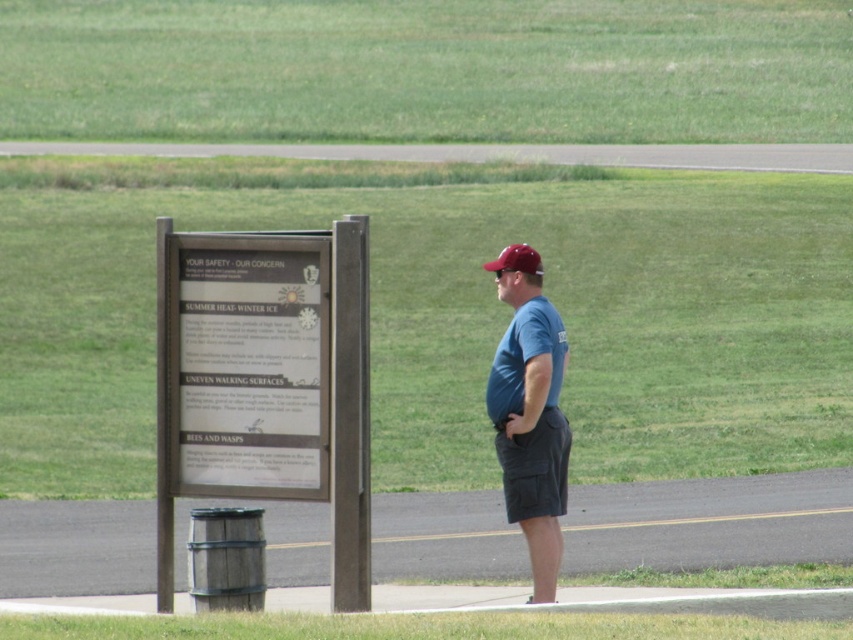
You are a park visitor holding a 10 meter long rope. You want to tie one end to the brushed metal sign at left and the other end to a camera that is 9.61 meters away. Is the rope long enough?

The distance between the brushed metal sign at left and the camera is 9.61 meters, so the 10 meter long rope is sufficient to tie between them.

Consider the image. You are standing in the park and see the brushed metal sign at left. Where is it located in the image?

The brushed metal sign at left is located at point (265, 381).

You are a fashion designer analyzing clothing items in an outdoor scene. You notice the blue cotton shirt at center and dark gray cotton shorts at right. Which clothing item is taller?

The blue cotton shirt at center is much taller than dark gray cotton shorts at right.